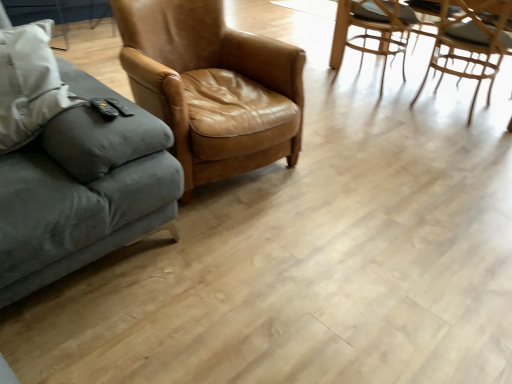
Measure the distance between point (x=372, y=9) and camera.

Point (x=372, y=9) and camera are 9.87 feet apart.

What do you see at coordinates (208, 83) in the screenshot?
I see `brown leather chair at center, the 3th chair in the right-to-left sequence` at bounding box center [208, 83].

This screenshot has height=384, width=512. What are the coordinates of `velvet gray couch at left` in the screenshot? It's located at (82, 189).

Between velvet gray couch at left and light brown woven chair at upper right, which is counted as the first chair, starting from the right, which one has smaller size?

light brown woven chair at upper right, which is counted as the first chair, starting from the right, is smaller.

Which of these two, velvet gray couch at left or light brown woven chair at upper right, the third chair positioned from the left, is thinner?

Thinner between the two is light brown woven chair at upper right, the third chair positioned from the left.

From a real-world perspective, does velvet gray couch at left stand above light brown woven chair at upper right, the third chair positioned from the left?

Yes, from a real-world perspective, velvet gray couch at left is over light brown woven chair at upper right, the third chair positioned from the left

Would you say velvet gray couch at left contains light brown woven chair at upper right, which is counted as the first chair, starting from the right?

No, light brown woven chair at upper right, which is counted as the first chair, starting from the right, is not inside velvet gray couch at left.

Is brown leather chair at center, the 1th chair positioned from the left, looking in the opposite direction of velvet gray couch at left?

No, brown leather chair at center, the 1th chair positioned from the left, is not facing away from velvet gray couch at left.

Would you say brown leather chair at center, the 3th chair in the right-to-left sequence, contains velvet gray couch at left?

No, velvet gray couch at left is not a part of brown leather chair at center, the 3th chair in the right-to-left sequence.

Which is in front, brown leather chair at center, the 1th chair positioned from the left, or velvet gray couch at left?

velvet gray couch at left is more forward.

Which of these two, brown leather chair at center, the 1th chair positioned from the left, or velvet gray couch at left, stands taller?

Standing taller between the two is velvet gray couch at left.

Is velvet gray couch at left positioned with its back to brown leather chair at center, the 3th chair in the right-to-left sequence?

velvet gray couch at left is not turned away from brown leather chair at center, the 3th chair in the right-to-left sequence.

Is brown leather chair at center, the 1th chair positioned from the left, completely or partially inside velvet gray couch at left?

No, velvet gray couch at left does not contain brown leather chair at center, the 1th chair positioned from the left.

Is velvet gray couch at left bigger or smaller than brown leather chair at center, the 1th chair positioned from the left?

Clearly, velvet gray couch at left is larger in size than brown leather chair at center, the 1th chair positioned from the left.

Which is closer to the camera, (121, 183) or (157, 65)?

The point (121, 183) is more forward.

Measure the distance between brown leather chair at center, the 1th chair positioned from the left, and light brown woven chair at upper right, positioned as the 2th chair in left-to-right order.

brown leather chair at center, the 1th chair positioned from the left, is 1.58 meters away from light brown woven chair at upper right, positioned as the 2th chair in left-to-right order.

From a real-world perspective, which object rests below the other?

In real-world perspective, light brown woven chair at upper right, positioned as the 2th chair in left-to-right order, is lower.

In the image, is brown leather chair at center, the 1th chair positioned from the left, positioned in front of or behind light brown woven chair at upper right, positioned as the 2th chair in left-to-right order?

Clearly, brown leather chair at center, the 1th chair positioned from the left, is in front of light brown woven chair at upper right, positioned as the 2th chair in left-to-right order.

Which of these two, brown leather chair at center, the 3th chair in the right-to-left sequence, or light brown woven chair at upper right, the 2th chair viewed from the right, stands shorter?

Standing shorter between the two is light brown woven chair at upper right, the 2th chair viewed from the right.

Could you tell me if light brown woven chair at upper right, the third chair positioned from the left, is turned towards light brown woven chair at upper right, the 2th chair viewed from the right?

No, light brown woven chair at upper right, the third chair positioned from the left, does not turn towards light brown woven chair at upper right, the 2th chair viewed from the right.

Considering the points (501, 14) and (394, 41), which point is behind, point (501, 14) or point (394, 41)?

The point (394, 41) is behind.

Based on their positions, is light brown woven chair at upper right, which is counted as the first chair, starting from the right, located to the left or right of light brown woven chair at upper right, the 2th chair viewed from the right?

light brown woven chair at upper right, which is counted as the first chair, starting from the right, is to the right of light brown woven chair at upper right, the 2th chair viewed from the right.

In the scene shown: Which of these two, light brown woven chair at upper right, positioned as the 2th chair in left-to-right order, or brown leather chair at center, the 3th chair in the right-to-left sequence, is wider?

brown leather chair at center, the 3th chair in the right-to-left sequence, is wider.

Between light brown woven chair at upper right, positioned as the 2th chair in left-to-right order, and brown leather chair at center, the 3th chair in the right-to-left sequence, which one is positioned behind?

Positioned behind is light brown woven chair at upper right, positioned as the 2th chair in left-to-right order.

Does point (345, 17) come farther from viewer compared to point (124, 43)?

Yes.

Is light brown woven chair at upper right, the 2th chair viewed from the right, completely or partially outside of light brown woven chair at upper right, which is counted as the first chair, starting from the right?

light brown woven chair at upper right, the 2th chair viewed from the right, is positioned outside light brown woven chair at upper right, which is counted as the first chair, starting from the right.

Considering the sizes of objects light brown woven chair at upper right, the 2th chair viewed from the right, and light brown woven chair at upper right, which is counted as the first chair, starting from the right, in the image provided, who is thinner, light brown woven chair at upper right, the 2th chair viewed from the right, or light brown woven chair at upper right, which is counted as the first chair, starting from the right,?

Thinner between the two is light brown woven chair at upper right, which is counted as the first chair, starting from the right.

Is light brown woven chair at upper right, the 2th chair viewed from the right, beside light brown woven chair at upper right, which is counted as the first chair, starting from the right?

light brown woven chair at upper right, the 2th chair viewed from the right, and light brown woven chair at upper right, which is counted as the first chair, starting from the right, are clearly separated.

Where is `the 2nd chair behind the velvet gray couch at left`? The image size is (512, 384). the 2nd chair behind the velvet gray couch at left is located at coordinates (470, 45).

Find the location of a particular element. This screenshot has height=384, width=512. the 1st chair counting from the right of the velvet gray couch at left is located at coordinates (208, 83).

Considering their positions, is light brown woven chair at upper right, positioned as the 2th chair in left-to-right order, positioned closer to brown leather chair at center, the 3th chair in the right-to-left sequence, than light brown woven chair at upper right, the third chair positioned from the left?

light brown woven chair at upper right, the third chair positioned from the left, lies closer to brown leather chair at center, the 3th chair in the right-to-left sequence, than the other object.

Estimate the real-world distances between objects in this image. Which object is further from velvet gray couch at left, brown leather chair at center, the 1th chair positioned from the left, or light brown woven chair at upper right, positioned as the 2th chair in left-to-right order?

light brown woven chair at upper right, positioned as the 2th chair in left-to-right order, is further to velvet gray couch at left.

Looking at the image, which one is located further to light brown woven chair at upper right, the third chair positioned from the left, light brown woven chair at upper right, the 2th chair viewed from the right, or brown leather chair at center, the 3th chair in the right-to-left sequence?

brown leather chair at center, the 3th chair in the right-to-left sequence, is positioned further to the anchor light brown woven chair at upper right, the third chair positioned from the left.

Considering their positions, is light brown woven chair at upper right, the third chair positioned from the left, positioned further to velvet gray couch at left than light brown woven chair at upper right, the 2th chair viewed from the right?

light brown woven chair at upper right, the 2th chair viewed from the right, lies further to velvet gray couch at left than the other object.

From the image, which object appears to be farther from brown leather chair at center, the 3th chair in the right-to-left sequence, light brown woven chair at upper right, which is counted as the first chair, starting from the right, or velvet gray couch at left?

light brown woven chair at upper right, which is counted as the first chair, starting from the right, is positioned further to the anchor brown leather chair at center, the 3th chair in the right-to-left sequence.

Based on their spatial positions, is velvet gray couch at left or light brown woven chair at upper right, the 2th chair viewed from the right, closer to brown leather chair at center, the 1th chair positioned from the left?

velvet gray couch at left is closer to brown leather chair at center, the 1th chair positioned from the left.

Based on their spatial positions, is velvet gray couch at left or light brown woven chair at upper right, which is counted as the first chair, starting from the right, further from brown leather chair at center, the 1th chair positioned from the left?

light brown woven chair at upper right, which is counted as the first chair, starting from the right, is positioned further to the anchor brown leather chair at center, the 1th chair positioned from the left.

When comparing their distances from light brown woven chair at upper right, the 2th chair viewed from the right, does light brown woven chair at upper right, which is counted as the first chair, starting from the right, or brown leather chair at center, the 3th chair in the right-to-left sequence, seem closer?

light brown woven chair at upper right, which is counted as the first chair, starting from the right, is closer to light brown woven chair at upper right, the 2th chair viewed from the right.

Image resolution: width=512 pixels, height=384 pixels. In order to click on chair located between brown leather chair at center, the 1th chair positioned from the left, and light brown woven chair at upper right, which is counted as the first chair, starting from the right, in the left-right direction in this screenshot , I will do `click(375, 29)`.